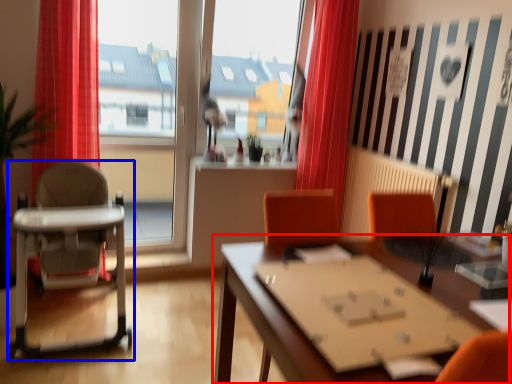
Question: Which object appears closest to the camera in this image, table (highlighted by a red box) or chair (highlighted by a blue box)?

Choices:
 (A) table
 (B) chair

Answer: (A)